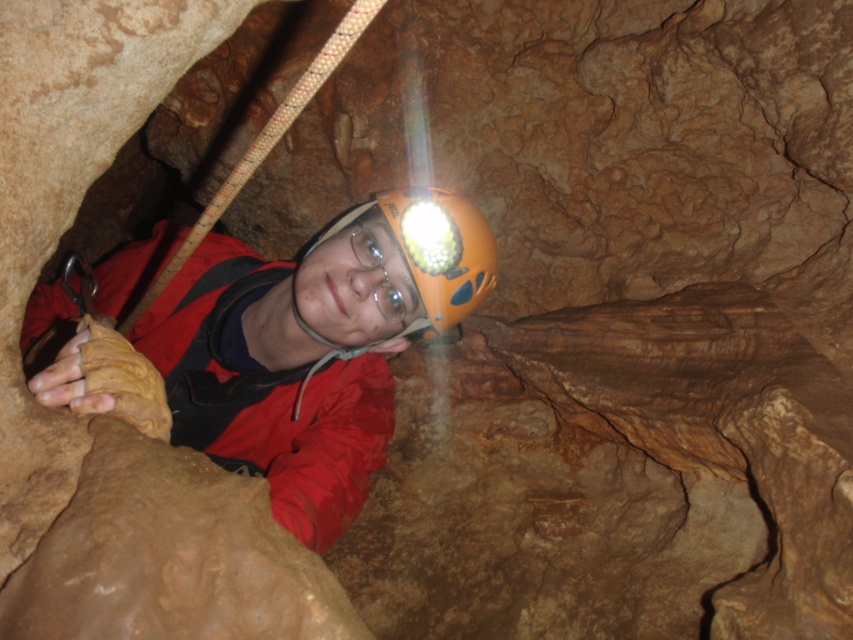
You are a caver wearing a red jacket and a matte orange helmet. You notice a point marked at coordinates (289, 349). Based on the scene description, where is this point located?

The point at (289, 349) is on the matte orange helmet at center.

You are a caver preparing to enter a narrow cave passage. You have two helmets, the matte orange helmet at center and the orange matte helmet at center. Which helmet should you choose if you want the one with the smaller height to fit through the tight space?

You should choose the orange matte helmet at center because it has a smaller height compared to the matte orange helmet at center, making it easier to fit through the tight space.

You are navigating a cave and need to check the position of your matte orange helmet at center. According to the coordinates provided, where exactly is it placed?

The matte orange helmet at center is located at point (289, 349).